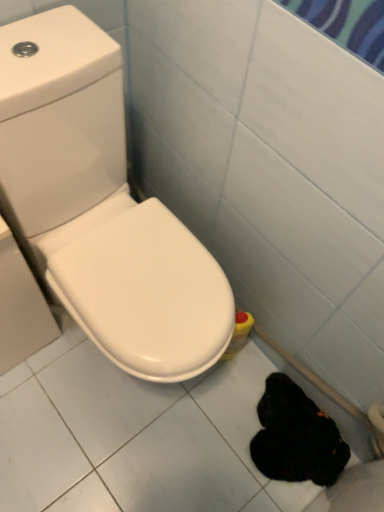
What do you see at coordinates (296, 436) in the screenshot? This screenshot has width=384, height=512. I see `black fuzzy animal at lower right` at bounding box center [296, 436].

The height and width of the screenshot is (512, 384). I want to click on black fuzzy animal at lower right, so click(x=296, y=436).

Describe the element at coordinates (101, 205) in the screenshot. Image resolution: width=384 pixels, height=512 pixels. I see `white glossy toilet at center-left` at that location.

Locate an element on the screen. white glossy toilet at center-left is located at coordinates (101, 205).

I want to click on black fuzzy animal at lower right, so click(x=296, y=436).

Considering the positions of objects black fuzzy animal at lower right and white glossy toilet at center-left in the image provided, who is more to the right, black fuzzy animal at lower right or white glossy toilet at center-left?

Positioned to the right is black fuzzy animal at lower right.

Which object is closer to the camera taking this photo, black fuzzy animal at lower right or white glossy toilet at center-left?

Positioned in front is white glossy toilet at center-left.

Which is behind, point (274, 432) or point (122, 243)?

The point (274, 432) is behind.

From the image's perspective, is black fuzzy animal at lower right located above or below white glossy toilet at center-left?

black fuzzy animal at lower right is below white glossy toilet at center-left.

From a real-world perspective, is black fuzzy animal at lower right positioned under white glossy toilet at center-left based on gravity?

Indeed, from a real-world perspective, black fuzzy animal at lower right is positioned beneath white glossy toilet at center-left.

Which of these two, black fuzzy animal at lower right or white glossy toilet at center-left, is wider?

Wider between the two is white glossy toilet at center-left.

Does black fuzzy animal at lower right have a lesser height compared to white glossy toilet at center-left?

Indeed, black fuzzy animal at lower right has a lesser height compared to white glossy toilet at center-left.

Considering the relative sizes of black fuzzy animal at lower right and white glossy toilet at center-left in the image provided, is black fuzzy animal at lower right smaller than white glossy toilet at center-left?

Yes, black fuzzy animal at lower right is smaller than white glossy toilet at center-left.

Would you say black fuzzy animal at lower right is outside white glossy toilet at center-left?

Yes.

Would you consider black fuzzy animal at lower right to be distant from white glossy toilet at center-left?

black fuzzy animal at lower right is near white glossy toilet at center-left, not far away.

Is black fuzzy animal at lower right facing towards white glossy toilet at center-left?

No, black fuzzy animal at lower right is not facing towards white glossy toilet at center-left.

Can you tell me how much black fuzzy animal at lower right and white glossy toilet at center-left differ in facing direction?

black fuzzy animal at lower right and white glossy toilet at center-left are facing 92.2 degrees away from each other.

Locate an element on the screen. The image size is (384, 512). toilet that is above the black fuzzy animal at lower right (from the image's perspective) is located at coordinates click(x=101, y=205).

Is white glossy toilet at center-left to the left or to the right of black fuzzy animal at lower right in the image?

In the image, white glossy toilet at center-left appears on the left side of black fuzzy animal at lower right.

In the image, is white glossy toilet at center-left positioned in front of or behind black fuzzy animal at lower right?

white glossy toilet at center-left is positioned closer to the viewer than black fuzzy animal at lower right.

Does point (27, 152) appear closer or farther from the camera than point (335, 463)?

Point (27, 152) is positioned closer to the camera compared to point (335, 463).

From the image's perspective, is white glossy toilet at center-left located above or below black fuzzy animal at lower right?

Clearly, from the image's perspective, white glossy toilet at center-left is above black fuzzy animal at lower right.

From a real-world perspective, is white glossy toilet at center-left physically located above or below black fuzzy animal at lower right?

white glossy toilet at center-left is situated higher than black fuzzy animal at lower right in the real world.

Does white glossy toilet at center-left have a greater width compared to black fuzzy animal at lower right?

Correct, the width of white glossy toilet at center-left exceeds that of black fuzzy animal at lower right.

Considering the sizes of objects white glossy toilet at center-left and black fuzzy animal at lower right in the image provided, who is shorter, white glossy toilet at center-left or black fuzzy animal at lower right?

black fuzzy animal at lower right.

Consider the image. Considering the relative sizes of white glossy toilet at center-left and black fuzzy animal at lower right in the image provided, is white glossy toilet at center-left smaller than black fuzzy animal at lower right?

No, white glossy toilet at center-left is not smaller than black fuzzy animal at lower right.

Is white glossy toilet at center-left outside of black fuzzy animal at lower right?

white glossy toilet at center-left lies outside black fuzzy animal at lower right's area.

Is white glossy toilet at center-left not close to black fuzzy animal at lower right?

No, white glossy toilet at center-left is in close proximity to black fuzzy animal at lower right.

Is white glossy toilet at center-left oriented towards black fuzzy animal at lower right?

Yes, white glossy toilet at center-left is oriented towards black fuzzy animal at lower right.

Looking at this image, what's the angular difference between white glossy toilet at center-left and black fuzzy animal at lower right's facing directions?

92.2 degrees separate the facing orientations of white glossy toilet at center-left and black fuzzy animal at lower right.

The image size is (384, 512). What are the coordinates of `toilet lying on the left of black fuzzy animal at lower right` in the screenshot? It's located at (101, 205).

In the image, there is a black fuzzy animal at lower right. At what (x,y) coordinates should I click in order to perform the action: click on toilet above it (from the image's perspective). Please return your answer as a coordinate pair (x, y). The height and width of the screenshot is (512, 384). Looking at the image, I should click on (101, 205).

Locate an element on the screen. toilet in front of the black fuzzy animal at lower right is located at coordinates (101, 205).